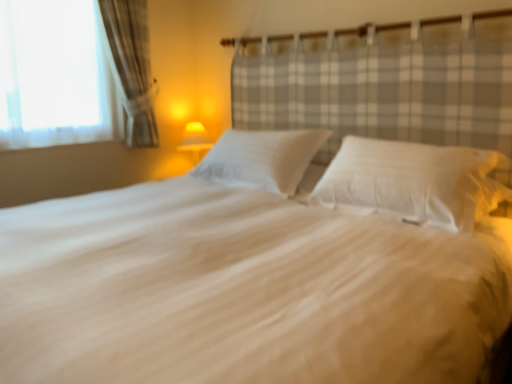
Question: Should I look upward or downward to see white soft bed at center?

Choices:
 (A) up
 (B) down

Answer: (B)

Question: Does white soft pillow at center, marked as the 2th pillow in a left-to-right arrangement, have a greater width compared to white soft bed at center?

Choices:
 (A) no
 (B) yes

Answer: (A)

Question: From the image's perspective, would you say white soft pillow at center, the 1th pillow from the right, is positioned over white soft bed at center?

Choices:
 (A) no
 (B) yes

Answer: (B)

Question: Is white soft pillow at center, marked as the 2th pillow in a left-to-right arrangement, surrounding white soft bed at center?

Choices:
 (A) yes
 (B) no

Answer: (B)

Question: Is white soft pillow at center, marked as the 2th pillow in a left-to-right arrangement, at the left side of white soft bed at center?

Choices:
 (A) no
 (B) yes

Answer: (A)

Question: Considering the relative positions of white soft pillow at center, the 1th pillow from the right, and white soft bed at center in the image provided, is white soft pillow at center, the 1th pillow from the right, to the right of white soft bed at center from the viewer's perspective?

Choices:
 (A) no
 (B) yes

Answer: (B)

Question: From the image's perspective, would you say white soft pillow at center, the 1th pillow from the right, is shown under white soft bed at center?

Choices:
 (A) yes
 (B) no

Answer: (B)

Question: Is white soft pillow at center, positioned as the first pillow in left-to-right order, surrounding white soft bed at center?

Choices:
 (A) no
 (B) yes

Answer: (A)

Question: Can you confirm if white soft pillow at center, positioned as the first pillow in left-to-right order, is positioned to the right of white soft bed at center?

Choices:
 (A) no
 (B) yes

Answer: (B)

Question: Is white soft pillow at center, the second pillow from the right, positioned beyond the bounds of white soft bed at center?

Choices:
 (A) no
 (B) yes

Answer: (A)

Question: Could you tell me if white soft pillow at center, the second pillow from the right, is facing white soft bed at center?

Choices:
 (A) yes
 (B) no

Answer: (A)

Question: Considering the relative sizes of white soft pillow at center, positioned as the first pillow in left-to-right order, and white soft bed at center in the image provided, is white soft pillow at center, positioned as the first pillow in left-to-right order, taller than white soft bed at center?

Choices:
 (A) no
 (B) yes

Answer: (A)

Question: Considering the relative sizes of white soft pillow at center, the second pillow from the right, and white soft bed at center in the image provided, is white soft pillow at center, the second pillow from the right, smaller than white soft bed at center?

Choices:
 (A) no
 (B) yes

Answer: (B)

Question: Is white soft pillow at center, the second pillow from the right, further to camera compared to yellow fabric lampshade at center?

Choices:
 (A) yes
 (B) no

Answer: (B)